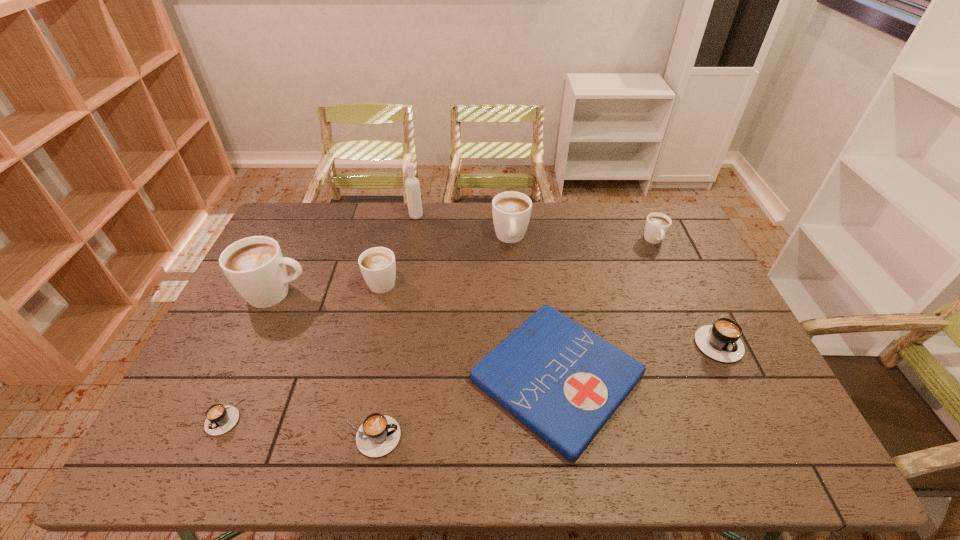
The width and height of the screenshot is (960, 540). What are the coordinates of `the fifth farthest cappuccino` in the screenshot? It's located at (721, 341).

I want to click on the sixth tallest cappuccino, so click(379, 434).

What are the coordinates of `the second smallest black cappuccino` in the screenshot? It's located at (379, 434).

Where is `the shortest cappuccino`? the shortest cappuccino is located at coordinates (219, 419).

Where is `the leftmost black cappuccino`? the leftmost black cappuccino is located at coordinates (219, 419).

What are the coordinates of `blue first-aid kit` in the screenshot? It's located at (563, 382).

What are the coordinates of `the first-aid kit` in the screenshot? It's located at (563, 382).

Identify the location of free spot located 0.090m on the right of the tallest object. (446, 216).

Find the location of a particular element. free space located with the handle on the side of the biggest white cappuccino is located at coordinates (396, 294).

Locate an element on the screen. blank area located with the handle on the side of the fifth cappuccino from left to right is located at coordinates (516, 316).